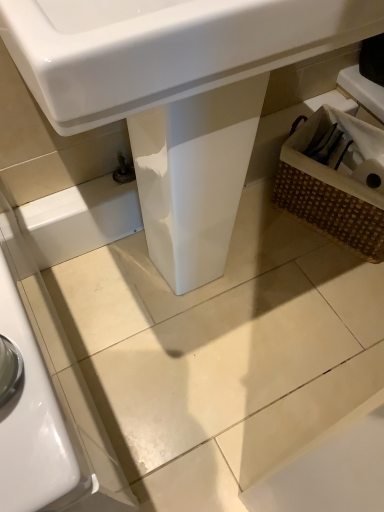
In order to click on vacant area that is in front of white glossy sink at center in this screenshot , I will do `click(205, 389)`.